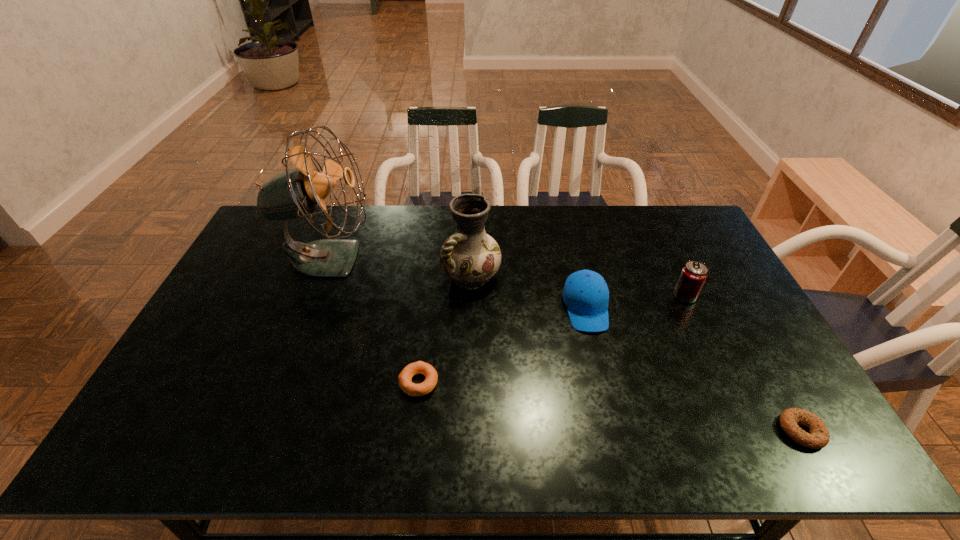
Where is `the fourth closest object to the leftmost object`? the fourth closest object to the leftmost object is located at coordinates (694, 273).

Where is `vacant area in the image that satisfies the following two spatial constraints: 1. on the front-facing side of the third tallest object for air flow; 2. on the left side of the tallest object`? The height and width of the screenshot is (540, 960). vacant area in the image that satisfies the following two spatial constraints: 1. on the front-facing side of the third tallest object for air flow; 2. on the left side of the tallest object is located at coordinates (313, 296).

The height and width of the screenshot is (540, 960). I want to click on vacant point that satisfies the following two spatial constraints: 1. on the front-facing side of the fan for air flow; 2. on the back side of the fifth shortest object, so click(x=322, y=275).

You are a GUI agent. You are given a task and a screenshot of the screen. Output one action in this format:
    pyautogui.click(x=<x>, y=<y>)
    Task: Click on the free space that satisfies the following two spatial constraints: 1. on the front-facing side of the tallest object for air flow; 2. on the left side of the left bagel
    The width and height of the screenshot is (960, 540).
    Given the screenshot: What is the action you would take?
    pyautogui.click(x=280, y=382)